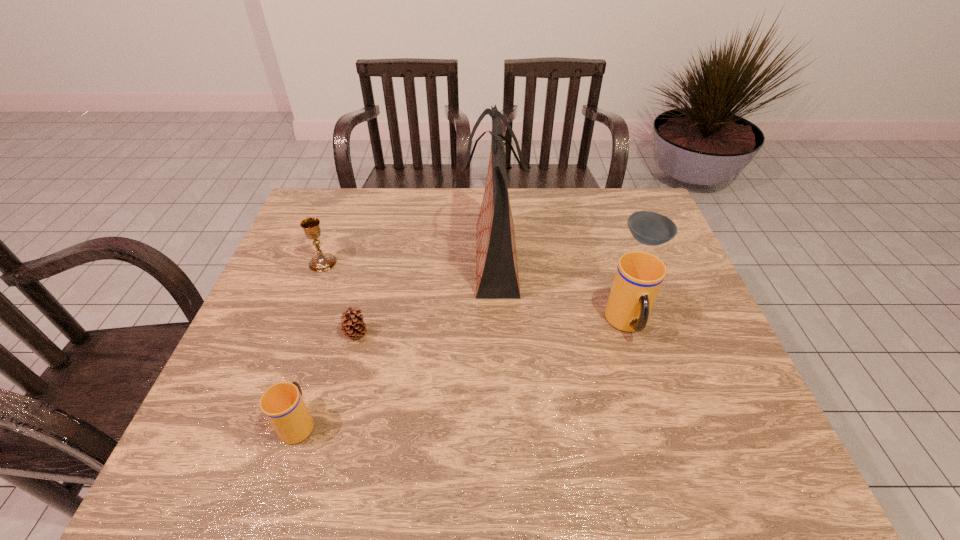
The height and width of the screenshot is (540, 960). In order to click on the second shortest object in this screenshot , I will do [353, 326].

Find the location of a particular element. pinecone is located at coordinates (353, 326).

Find the location of a particular element. This screenshot has height=540, width=960. vacant region located 0.290m on the side of the left cup with the handle is located at coordinates (337, 303).

Image resolution: width=960 pixels, height=540 pixels. I want to click on free space located on the side of the left cup with the handle, so click(x=343, y=285).

This screenshot has height=540, width=960. I want to click on free region located on the side of the left cup with the handle, so click(x=331, y=320).

Find the location of a particular element. Image resolution: width=960 pixels, height=540 pixels. vacant area situated on the side of the right cup with the handle is located at coordinates (650, 396).

What are the coordinates of `free space located on the front-facing side of the fourth object from left to right` in the screenshot? It's located at (420, 259).

The height and width of the screenshot is (540, 960). Identify the location of free space located on the front-facing side of the fourth object from left to right. (393, 259).

The height and width of the screenshot is (540, 960). Identify the location of vacant region located 0.400m on the front-facing side of the fourth object from left to right. (328, 259).

Identify the location of free region located 0.130m on the right of the chalice. (381, 263).